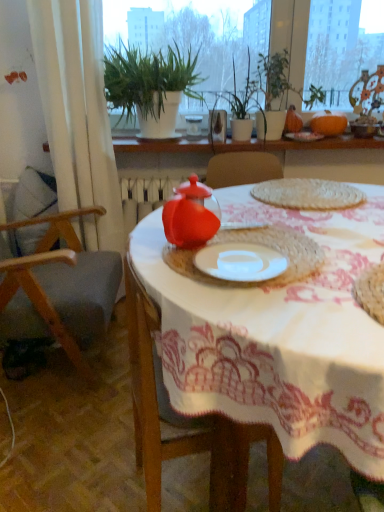
Question: In which direction should I rotate to look at matte plastic teapot at center, acting as the second tableware starting from the top?

Choices:
 (A) left
 (B) right

Answer: (A)

Question: From the image's perspective, is white textured plants at upper center beneath white fabric curtain at left?

Choices:
 (A) no
 (B) yes

Answer: (A)

Question: Can you confirm if white textured plants at upper center is taller than white fabric curtain at left?

Choices:
 (A) no
 (B) yes

Answer: (A)

Question: Considering the relative positions of white textured plants at upper center and white fabric curtain at left in the image provided, is white textured plants at upper center behind white fabric curtain at left?

Choices:
 (A) no
 (B) yes

Answer: (B)

Question: Considering the relative sizes of white textured plants at upper center and white fabric curtain at left in the image provided, is white textured plants at upper center wider than white fabric curtain at left?

Choices:
 (A) yes
 (B) no

Answer: (A)

Question: Is white textured plants at upper center with white fabric curtain at left?

Choices:
 (A) yes
 (B) no

Answer: (B)

Question: From a real-world perspective, is white textured plants at upper center physically above white fabric curtain at left?

Choices:
 (A) no
 (B) yes

Answer: (A)

Question: Is wooden chair at left turned away from matte glass table at center?

Choices:
 (A) no
 (B) yes

Answer: (A)

Question: From a real-world perspective, is wooden chair at left located beneath matte glass table at center?

Choices:
 (A) yes
 (B) no

Answer: (A)

Question: Would you say matte glass table at center is part of wooden chair at left's contents?

Choices:
 (A) no
 (B) yes

Answer: (A)

Question: Is wooden chair at left beside matte glass table at center?

Choices:
 (A) no
 (B) yes

Answer: (A)

Question: Does wooden chair at left appear on the left side of matte glass table at center?

Choices:
 (A) yes
 (B) no

Answer: (A)

Question: Can you confirm if wooden chair at left is taller than matte glass table at center?

Choices:
 (A) yes
 (B) no

Answer: (A)

Question: Could orange matte pumpkin at upper right be considered to be inside woven mat at center?

Choices:
 (A) yes
 (B) no

Answer: (B)